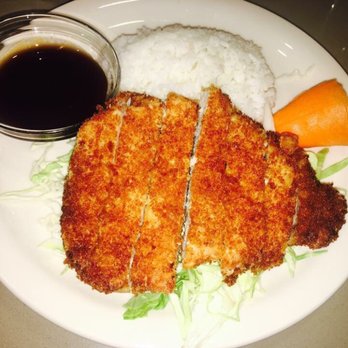
Locate an element on the screen. white plate is located at coordinates (58, 307).